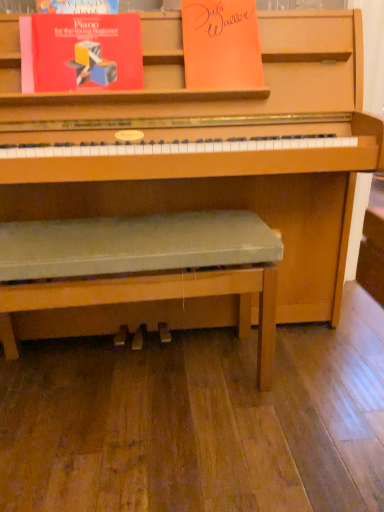
Question: Considering the positions of orange paper at upper center, the first paperback book positioned from the right, and matte red book at upper left, which appears as the second paperback book when viewed from the right, in the image, is orange paper at upper center, the first paperback book positioned from the right, taller or shorter than matte red book at upper left, which appears as the second paperback book when viewed from the right,?

Choices:
 (A) tall
 (B) short

Answer: (A)

Question: Based on their positions, is orange paper at upper center, arranged as the second paperback book when viewed from the left, located to the left or right of matte red book at upper left, which appears as the second paperback book when viewed from the right?

Choices:
 (A) left
 (B) right

Answer: (B)

Question: Estimate the real-world distances between objects in this image. Which object is farther from the green fabric bench at center?

Choices:
 (A) matte red book at upper left, which ranks as the first paperback book in left-to-right order
 (B) orange paper at upper center, arranged as the second paperback book when viewed from the left

Answer: (B)

Question: Estimate the real-world distances between objects in this image. Which object is farther from the matte red book at upper left, which ranks as the first paperback book in left-to-right order?

Choices:
 (A) orange paper at upper center, the first paperback book positioned from the right
 (B) green fabric bench at center

Answer: (B)